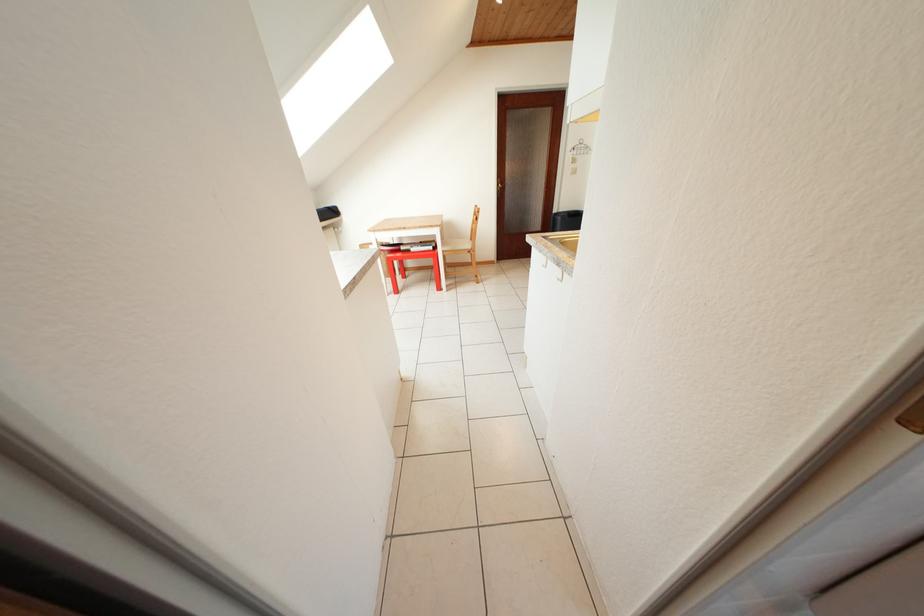
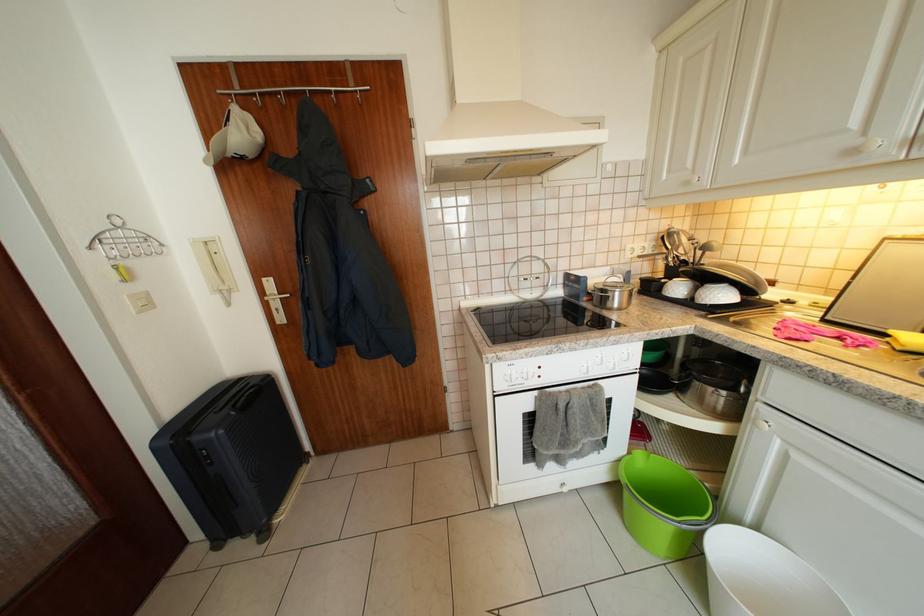
Find the pixel in the second image that matches (596,152) in the first image.

(156, 243)